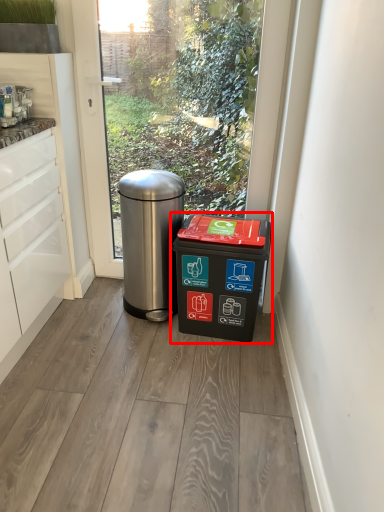
Question: From the image's perspective, where is waste container (annotated by the red box) located in relation to waste container in the image?

Choices:
 (A) below
 (B) above

Answer: (A)